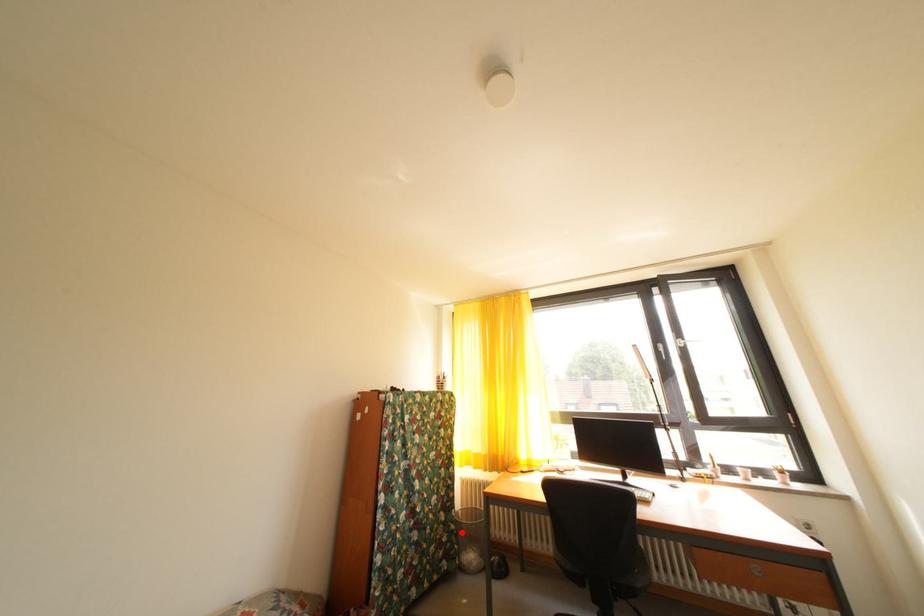
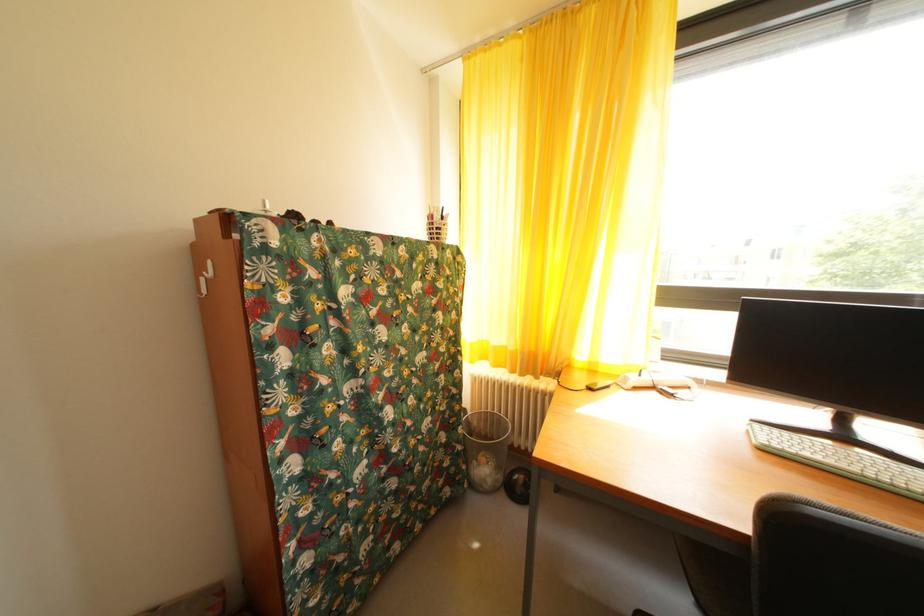
Question: A red point is marked in image1. In image2, is the corresponding 3D point closer to the camera or farther? Reply with the corresponding letter.

Choices:
 (A) The corresponding 3D point is closer.
 (B) The corresponding 3D point is farther.

Answer: (A)